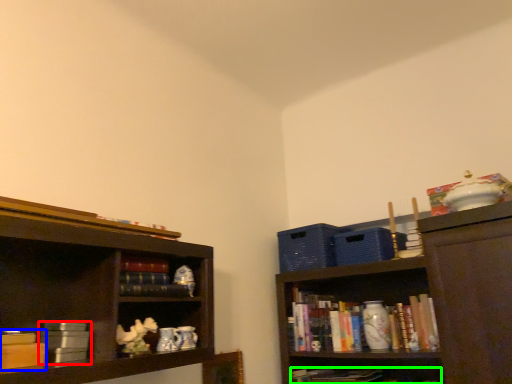
Question: Which is nearer to the book (highlighted by a red box)? book (highlighted by a blue box) or book (highlighted by a green box).

Choices:
 (A) book
 (B) book

Answer: (A)